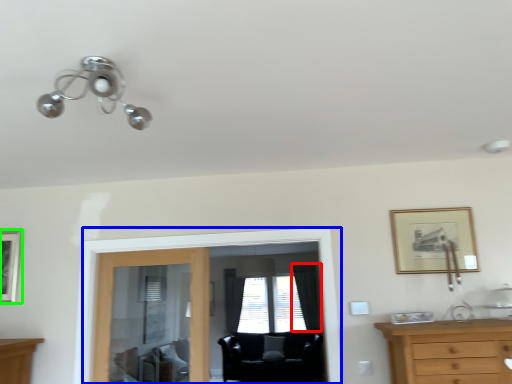
Question: Which is nearer to the curtain (highlighted by a red box)? screen door (highlighted by a blue box) or picture frame (highlighted by a green box).

Choices:
 (A) screen door
 (B) picture frame

Answer: (A)